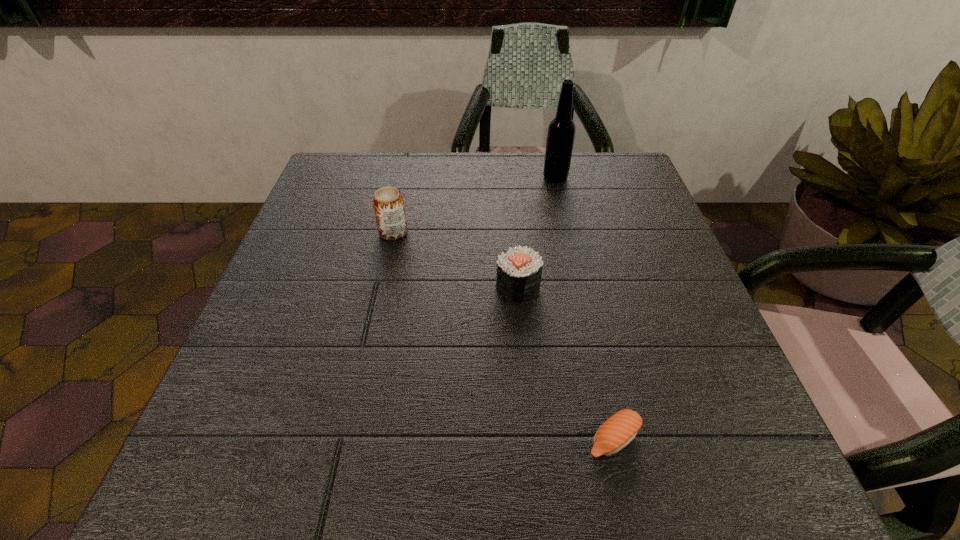
Image resolution: width=960 pixels, height=540 pixels. I want to click on vacant area between the farthest object and the nearest object, so click(x=585, y=308).

Locate an element on the screen. This screenshot has width=960, height=540. object that stands as the closest to the shorter sushi is located at coordinates point(519,270).

Select which object is the third closest to the third farthest object. Please provide its 2D coordinates. Your answer should be formatted as a tuple, i.e. [(x, y)], where the tuple contains the x and y coordinates of a point satisfying the conditions above.

[(561, 132)]

Where is `vacant area that satisfies the following two spatial constraints: 1. on the back side of the farthest object; 2. on the left side of the beer can`? The image size is (960, 540). vacant area that satisfies the following two spatial constraints: 1. on the back side of the farthest object; 2. on the left side of the beer can is located at coordinates (405, 178).

At what (x,y) coordinates should I click in order to perform the action: click on free point that satisfies the following two spatial constraints: 1. on the front side of the third object from right to left; 2. on the right side of the nearest object. Please return your answer as a coordinate pair (x, y). Looking at the image, I should click on (530, 439).

Where is `free space that satisfies the following two spatial constraints: 1. on the back side of the farthest object; 2. on the right side of the leftmost object`? This screenshot has width=960, height=540. free space that satisfies the following two spatial constraints: 1. on the back side of the farthest object; 2. on the right side of the leftmost object is located at coordinates (405, 178).

Locate an element on the screen. The image size is (960, 540). vacant position in the image that satisfies the following two spatial constraints: 1. on the front side of the leftmost object; 2. on the right side of the left sushi is located at coordinates (381, 287).